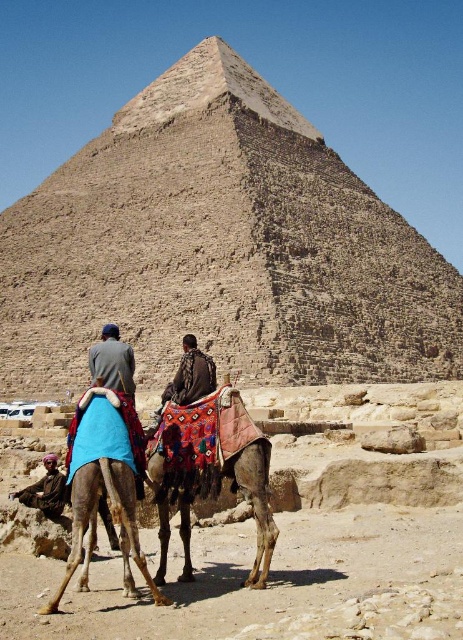
Question: Is brown stone pyramid at center positioned behind blue fabric cloth at center?

Choices:
 (A) no
 (B) yes

Answer: (B)

Question: From the image, what is the correct spatial relationship of brown stone pyramid at center in relation to multicolored fabric camel at center?

Choices:
 (A) left
 (B) right

Answer: (A)

Question: Which of the following is the farthest from the observer?

Choices:
 (A) blue fabric camel at lower left
 (B) multicolored fabric camel at center

Answer: (B)

Question: Does brown stone pyramid at center appear over blue fabric cloth at center?

Choices:
 (A) yes
 (B) no

Answer: (A)

Question: Estimate the real-world distances between objects in this image. Which object is closer to the brown textured camel at lower left?

Choices:
 (A) blue fabric camel at lower left
 (B) blue fabric cloth at center
 (C) multicolored fabric camel at center
 (D) brown stone pyramid at center

Answer: (C)

Question: Which object appears farthest from the camera in this image?

Choices:
 (A) brown stone pyramid at center
 (B) blue fabric cloth at center

Answer: (A)